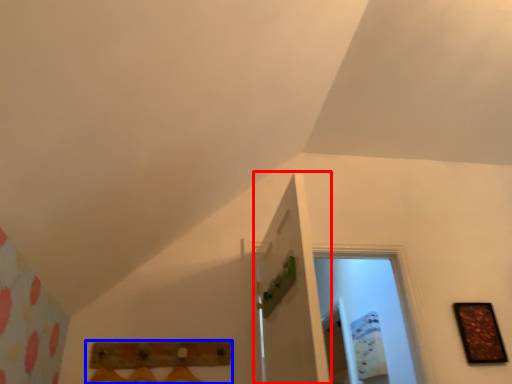
Question: Which of the following is the farthest to the observer, door (highlighted by a red box) or furniture (highlighted by a blue box)?

Choices:
 (A) door
 (B) furniture

Answer: (B)